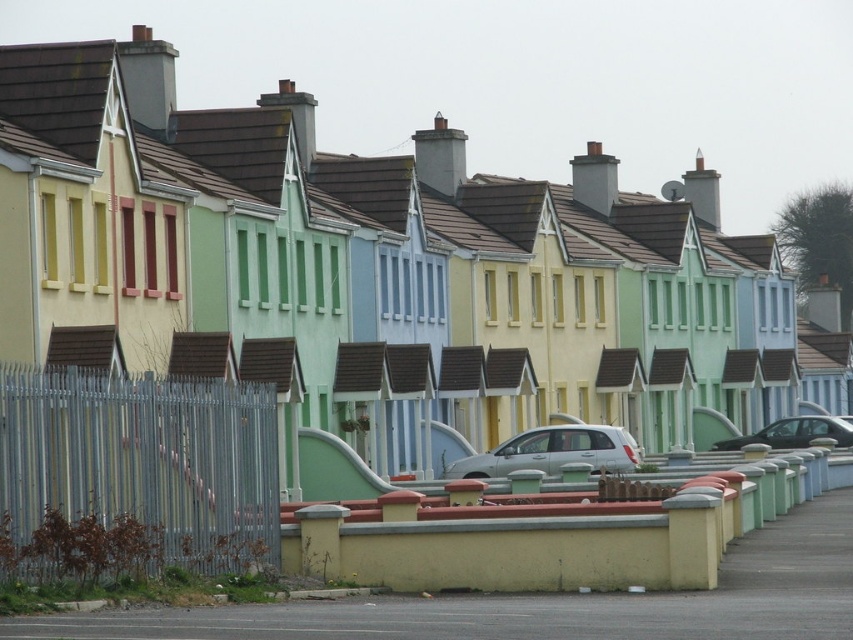
Is yellow matte wall at center to the left of shiny black car at center from the viewer's perspective?

Correct, you'll find yellow matte wall at center to the left of shiny black car at center.

Does yellow matte wall at center have a lesser width compared to shiny black car at center?

In fact, yellow matte wall at center might be wider than shiny black car at center.

Image resolution: width=853 pixels, height=640 pixels. What do you see at coordinates (550, 532) in the screenshot?
I see `yellow matte wall at center` at bounding box center [550, 532].

You are a GUI agent. You are given a task and a screenshot of the screen. Output one action in this format:
    pyautogui.click(x=<x>, y=<y>)
    Task: Click on the yellow matte wall at center
    This screenshot has height=640, width=853.
    Given the screenshot: What is the action you would take?
    pyautogui.click(x=550, y=532)

Based on the photo, who is shorter, yellow matte wall at center or white matte car at center?

With less height is white matte car at center.

Between yellow matte wall at center and white matte car at center, which one appears on the left side from the viewer's perspective?

Positioned to the left is yellow matte wall at center.

I want to click on yellow matte wall at center, so click(550, 532).

Can you confirm if white matte car at center is positioned to the left of shiny black car at center?

Correct, you'll find white matte car at center to the left of shiny black car at center.

Is white matte car at center in front of shiny black car at center?

Yes, it is in front of shiny black car at center.

Locate an element on the screen. This screenshot has width=853, height=640. white matte car at center is located at coordinates (552, 451).

Where is `white matte car at center`? white matte car at center is located at coordinates (552, 451).